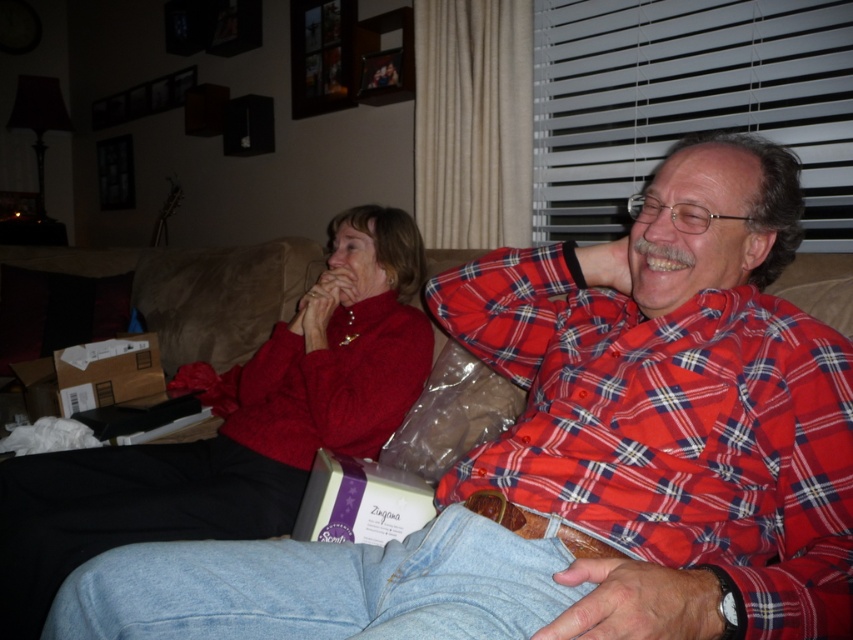
You are standing in the living room and want to place a small plant between the two points, point (537, 454) and point (345, 310). Which point should the plant be closer to if you want it to be closer to the person on the left?

The plant should be closer to point (345, 310) because point (537, 454) is in front of point (345, 310), meaning point (345, 310) is behind and closer to the person on the left.

You are a photographer taking a close up shot of the red plaid shirt at right. You want to focus on the point at coordinates point (670, 429). Is this point located on the red plaid shirt at right?

Yes, the point (670, 429) is on the red plaid shirt at right.

You are a photographer standing in front of the couch. You need to take a photo of both the red plaid shirt at right and the matte red sweater at left. Which one will appear larger in the photo?

The red plaid shirt at right will appear larger in the photo because it is closer to the viewer than the matte red sweater at left.